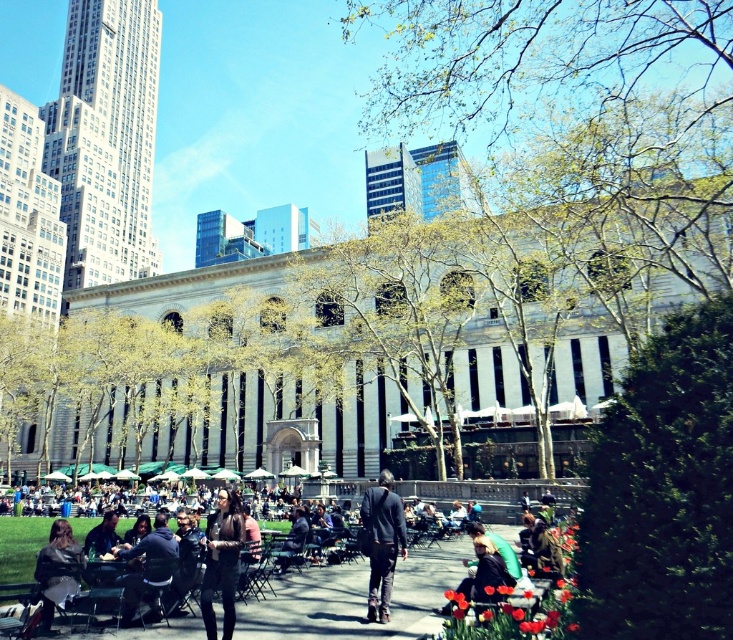
Question: Where is dark blue jeans at center located in relation to dark brown leather jacket at center in the image?

Choices:
 (A) below
 (B) above

Answer: (A)

Question: Which of the following is the farthest from the observer?

Choices:
 (A) dark blue jeans at center
 (B) dark gray jacket at lower left
 (C) dark brown leather jacket at center

Answer: (A)

Question: Among these objects, which one is nearest to the camera?

Choices:
 (A) dark blue jeans at center
 (B) dark gray jacket at lower left

Answer: (B)

Question: Is dark blue jeans at center further to camera compared to dark brown leather jacket at center?

Choices:
 (A) no
 (B) yes

Answer: (B)

Question: Can you confirm if dark blue jeans at center is thinner than dark brown leather jacket at center?

Choices:
 (A) no
 (B) yes

Answer: (B)

Question: Among these points, which one is farthest from the camera?

Choices:
 (A) (202, 584)
 (B) (375, 508)
 (C) (4, 564)

Answer: (C)